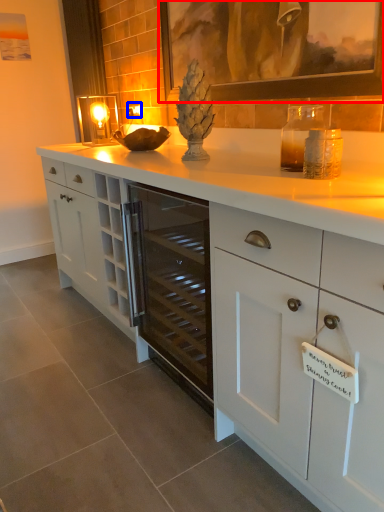
Question: Which of the following is the farthest to the observer, picture frame (highlighted by a red box) or electric outlet (highlighted by a blue box)?

Choices:
 (A) picture frame
 (B) electric outlet

Answer: (B)